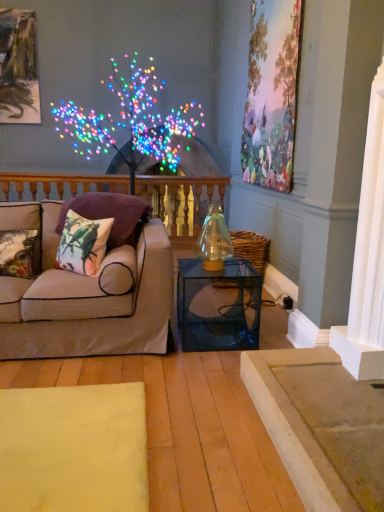
At what (x,y) coordinates should I click in order to perform the action: click on vacant space in front of transparent glass table at center. Please return your answer as a coordinate pair (x, y). This screenshot has width=384, height=512. Looking at the image, I should click on (198, 368).